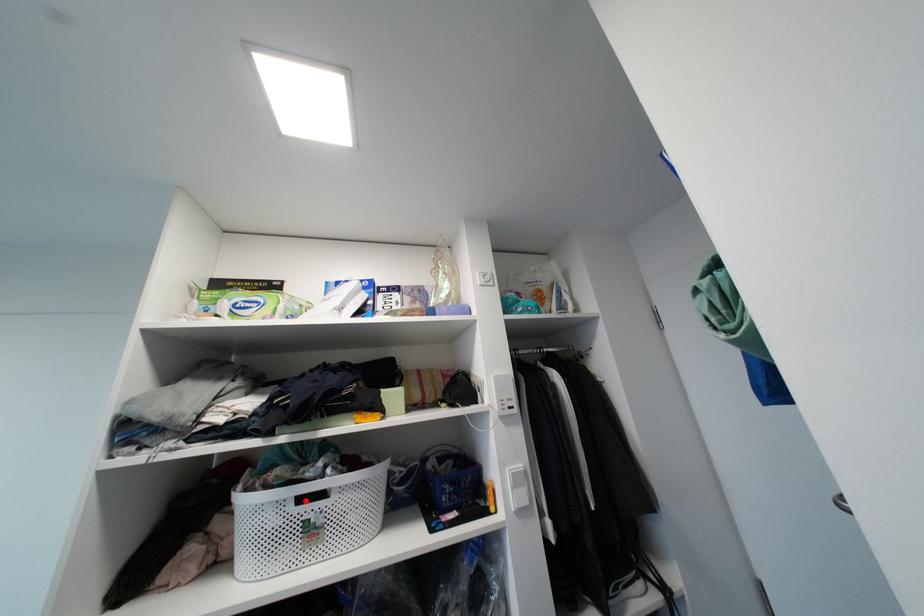
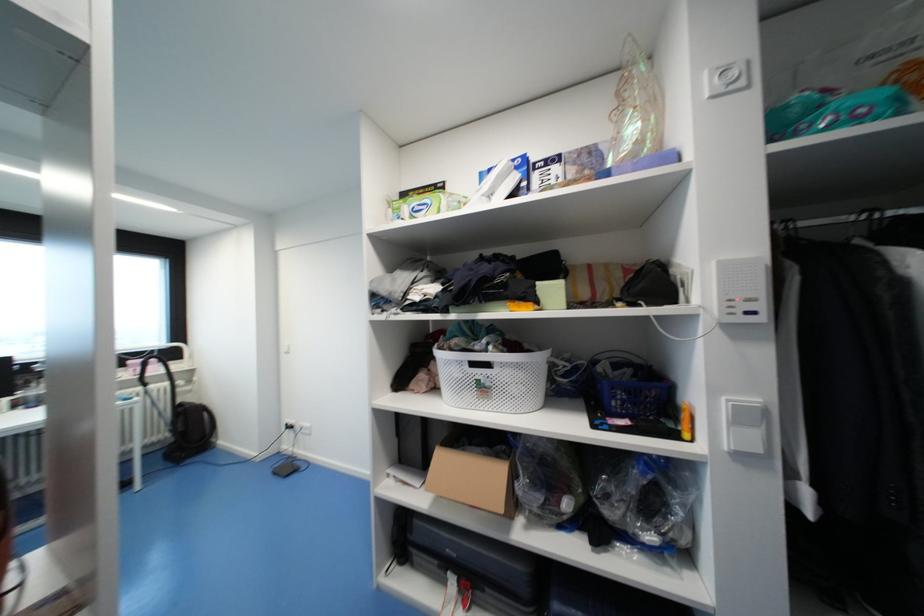
Locate, in the second image, the point that corresponds to the highlighted location in the first image.

(477, 365)